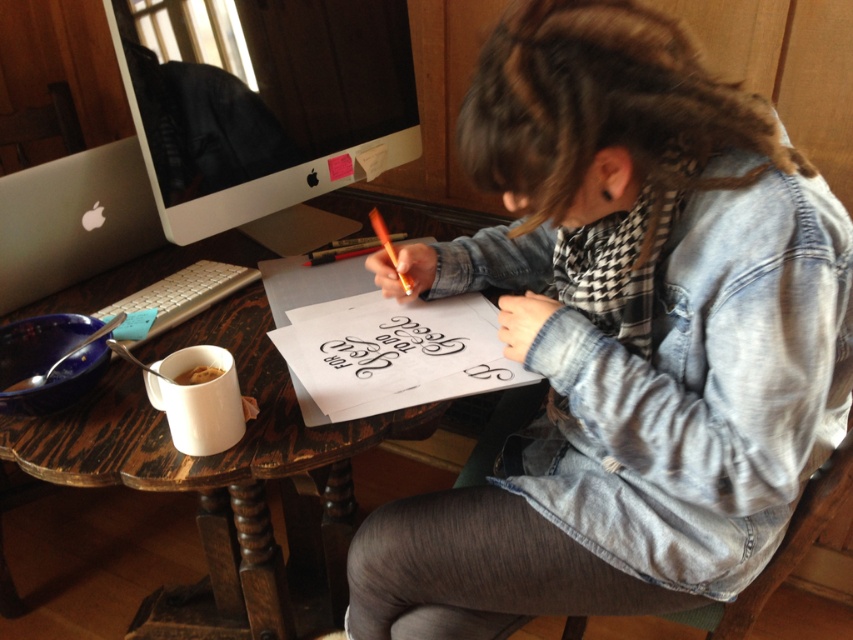
You are a delivery robot with a package that is 14 inches long. You need to place it on the wooden table at center without overlapping the black calligraphy at center. Is there enough space?

The distance between the wooden table at center and the black calligraphy at center is 14.11 inches. Since your package is 14 inches long, there is just enough space to place it on the wooden table at center without overlapping the black calligraphy at center.

You are organizing a small event and need to place a decorative centerpiece on the wooden table at center. Considering the current arrangement, where should you place the denim jacket at center to avoid blocking the table space?

The denim jacket at center is currently on the right side of the wooden table at center. To avoid blocking the table space, move it to the left side of the wooden table at center.